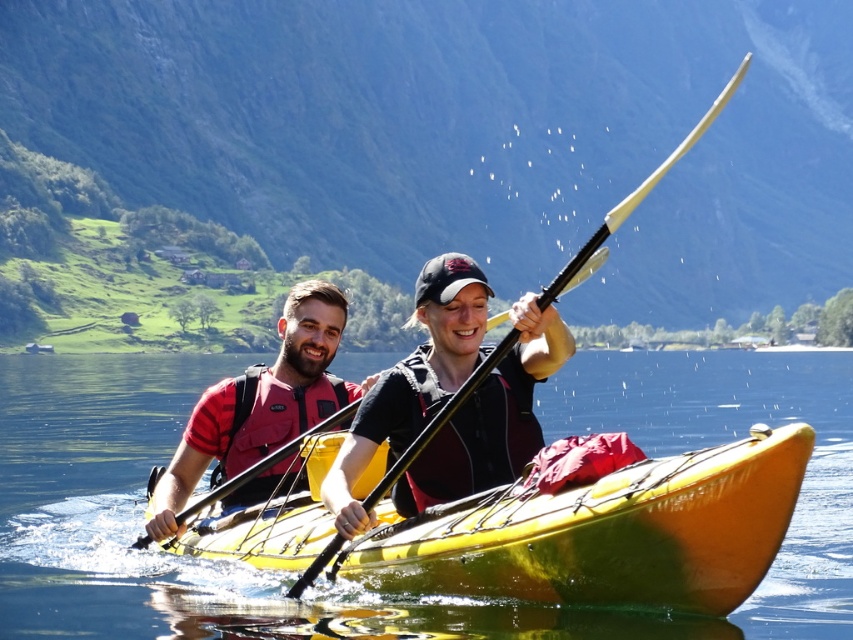
You are a photographer standing on the shore of the lake. You want to take a photo of the yellow glossy canoe at center and the red matte life vest at left. Which object should you focus on first to ensure both are in the frame?

The yellow glossy canoe at center is in front of the red matte life vest at left, so you should focus on the yellow glossy canoe at center first to ensure both are in the frame.

You are navigating a kayak and need to reach a point in the water. The coordinates of the two points are point (x=793, y=480) and point (x=196, y=465). Based on the scene, which point is closer to the kayak?

Point (x=793, y=480) is in front of point (x=196, y=465), so it is closer to the kayak.